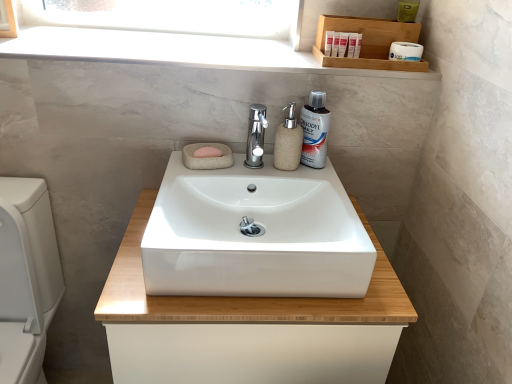
Identify the location of free space above wooden tray at upper right (from a real-world perspective). The width and height of the screenshot is (512, 384). (370, 16).